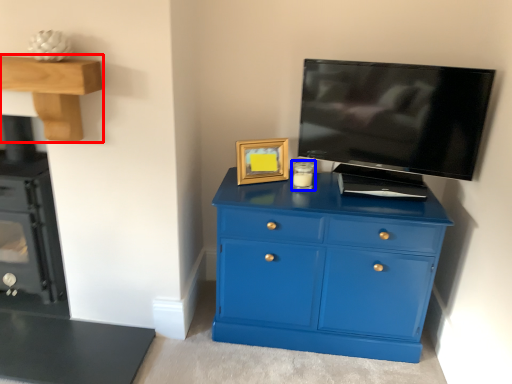
Question: Which object is further to the camera taking this photo, vanity (highlighted by a red box) or candle holder (highlighted by a blue box)?

Choices:
 (A) vanity
 (B) candle holder

Answer: (B)